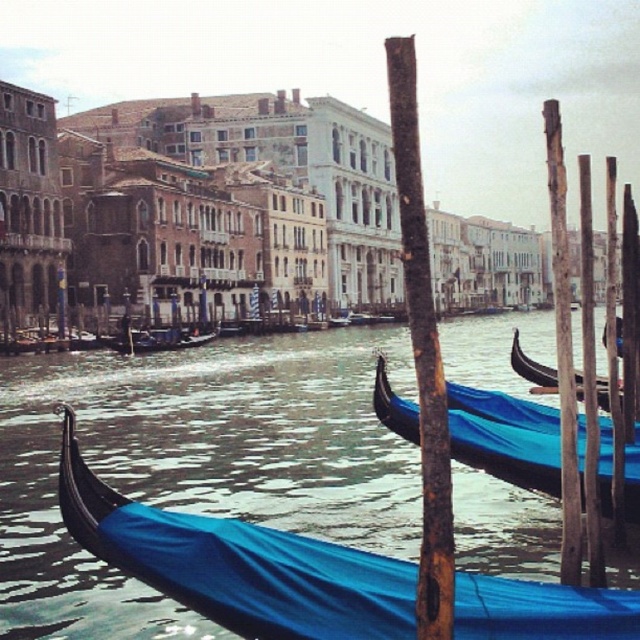
Question: Which object appears farthest from the camera in this image?

Choices:
 (A) blue fabric boat at center
 (B) shiny black gondola at right
 (C) blue polished wood gondola at center
 (D) blue fabric gondola at center

Answer: (A)

Question: Which is nearer to the blue fabric gondola at center?

Choices:
 (A) shiny black gondola at right
 (B) blue polished wood gondola at center

Answer: (A)

Question: Does shiny black gondola at right lie in front of blue fabric boat at center?

Choices:
 (A) yes
 (B) no

Answer: (A)

Question: Estimate the real-world distances between objects in this image. Which object is farther from the blue fabric boat at center?

Choices:
 (A) blue polished wood gondola at center
 (B) shiny black gondola at right

Answer: (A)

Question: Where is blue fabric gondola at center located in relation to shiny black gondola at right in the image?

Choices:
 (A) above
 (B) below

Answer: (B)

Question: From the image, what is the correct spatial relationship of blue polished wood gondola at center in relation to blue fabric gondola at center?

Choices:
 (A) below
 (B) above

Answer: (A)